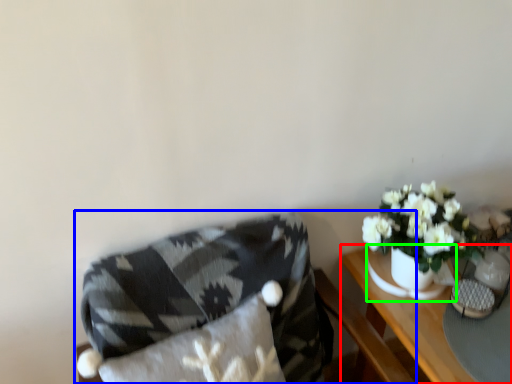
Question: Which object is positioned farthest from table (highlighted by a red box)? Select from chair (highlighted by a blue box) and vase (highlighted by a green box).

Choices:
 (A) chair
 (B) vase

Answer: (A)